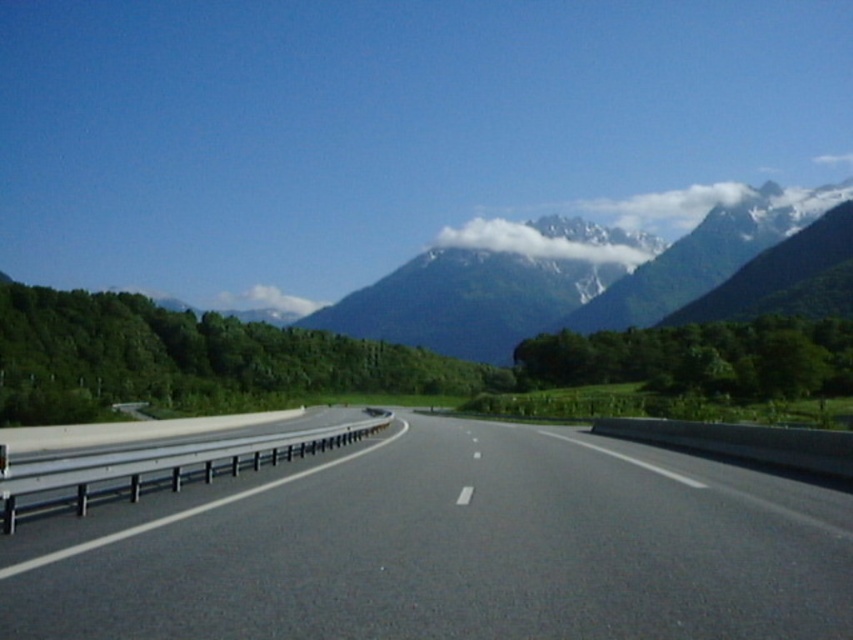
You are a driver approaching the black asphalt highway at center and the white fluffy cloud at center. Which one appears larger in the image?

The white fluffy cloud at center appears larger because it occupies more space than the black asphalt highway at center.

You are a driver approaching the black asphalt highway at center. You notice a white fluffy cloud at upper center in the distance. From your perspective, which object is closer to you?

The black asphalt highway at center is closer to you because it is in front of the white fluffy cloud at upper center.

You are a pilot flying a small plane and notice two clouds in the sky. One is the white fluffy cloud at center and the other is the white fluffy cloud at upper center. Which cloud is lower in the sky?

The white fluffy cloud at center is positioned over the white fluffy cloud at upper center, meaning it is lower in the sky since it appears closer to the ground.